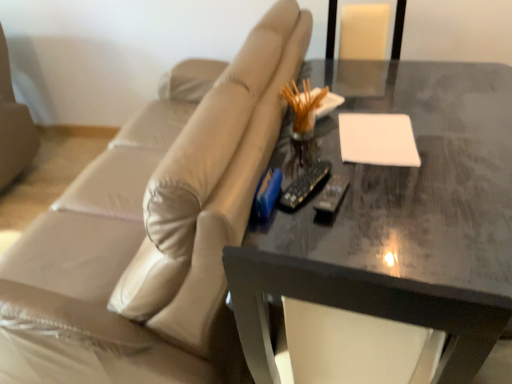
Question: Can you confirm if black plastic remote at center is smaller than beige leather couch at center?

Choices:
 (A) no
 (B) yes

Answer: (B)

Question: Does black plastic remote at center have a greater height compared to beige leather couch at center?

Choices:
 (A) no
 (B) yes

Answer: (A)

Question: Does black plastic remote at center lie in front of beige leather couch at center?

Choices:
 (A) no
 (B) yes

Answer: (A)

Question: Considering the relative sizes of black plastic remote at center and beige leather couch at center in the image provided, is black plastic remote at center shorter than beige leather couch at center?

Choices:
 (A) no
 (B) yes

Answer: (B)

Question: Does black plastic remote at center appear on the right side of beige leather couch at center?

Choices:
 (A) yes
 (B) no

Answer: (A)

Question: In terms of height, does beige leather couch at center look taller or shorter compared to white matte notepad at upper right?

Choices:
 (A) tall
 (B) short

Answer: (A)

Question: From a real-world perspective, is beige leather couch at center positioned above or below white matte notepad at upper right?

Choices:
 (A) below
 (B) above

Answer: (A)

Question: Looking at the image, does beige leather couch at center seem bigger or smaller compared to white matte notepad at upper right?

Choices:
 (A) small
 (B) big

Answer: (B)

Question: Is beige leather couch at center inside the boundaries of white matte notepad at upper right, or outside?

Choices:
 (A) inside
 (B) outside

Answer: (B)

Question: Is white matte notepad at upper right inside the boundaries of shiny dark gray table at center, or outside?

Choices:
 (A) inside
 (B) outside

Answer: (A)

Question: Is white matte notepad at upper right wider or thinner than shiny dark gray table at center?

Choices:
 (A) thin
 (B) wide

Answer: (A)

Question: From a real-world perspective, is white matte notepad at upper right physically located above or below shiny dark gray table at center?

Choices:
 (A) above
 (B) below

Answer: (A)

Question: Is point (410, 165) positioned closer to the camera than point (384, 274)?

Choices:
 (A) closer
 (B) farther

Answer: (B)

Question: In the image, is beige leather couch at center positioned in front of or behind shiny dark gray table at center?

Choices:
 (A) front
 (B) behind

Answer: (A)

Question: Choose the correct answer: Is beige leather couch at center inside shiny dark gray table at center or outside it?

Choices:
 (A) inside
 (B) outside

Answer: (B)